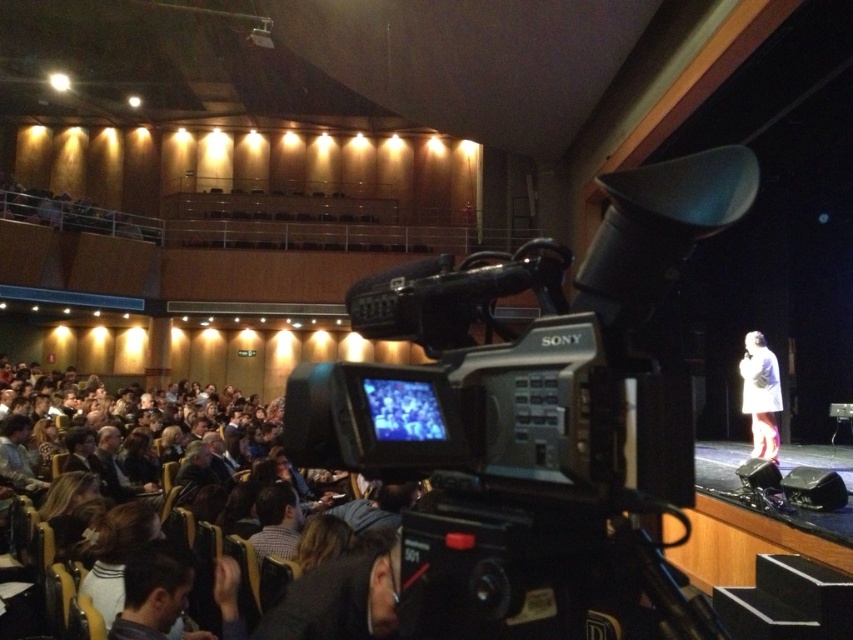
Question: Does black plastic video camera at center appear on the right side of white matte coat at stage right?

Choices:
 (A) no
 (B) yes

Answer: (A)

Question: Considering the relative positions of black plastic video camera at center and white matte coat at stage right in the image provided, where is black plastic video camera at center located with respect to white matte coat at stage right?

Choices:
 (A) above
 (B) below

Answer: (A)

Question: Which of the following is the closest to the observer?

Choices:
 (A) (474, 472)
 (B) (753, 349)

Answer: (A)

Question: Does black plastic video camera at center have a lesser width compared to white matte coat at stage right?

Choices:
 (A) yes
 (B) no

Answer: (B)